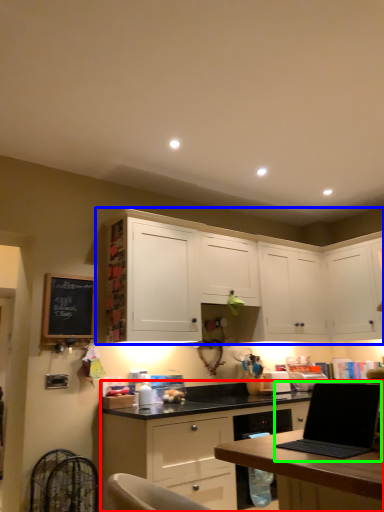
Question: Considering the real-world distances, which object is closest to cabinetry (highlighted by a red box)? cabinetry (highlighted by a blue box) or laptop (highlighted by a green box).

Choices:
 (A) cabinetry
 (B) laptop

Answer: (A)